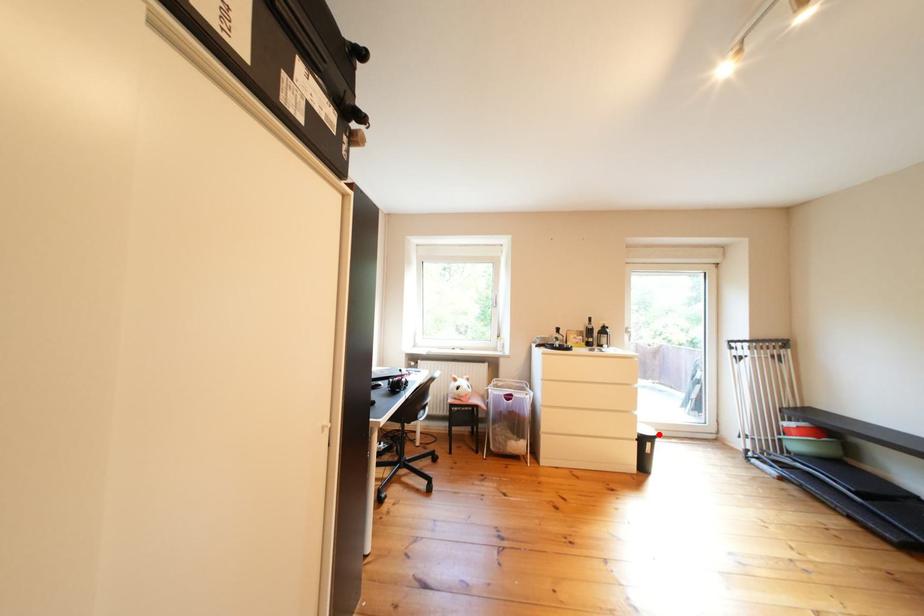
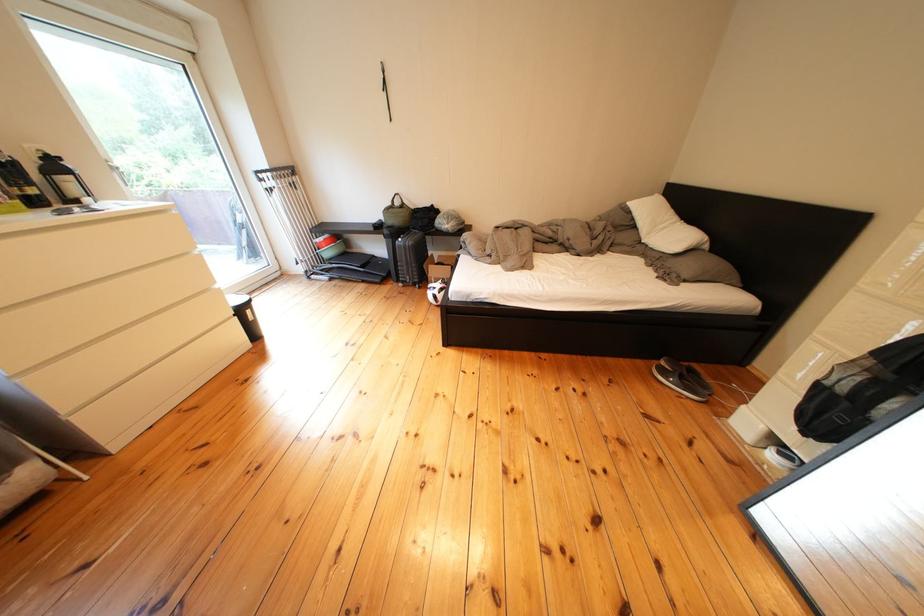
Question: A red point is marked in image1. In image2, is the corresponding 3D point closer to the camera or farther? Reply with the corresponding letter.

Choices:
 (A) The corresponding 3D point is closer.
 (B) The corresponding 3D point is farther.

Answer: (A)